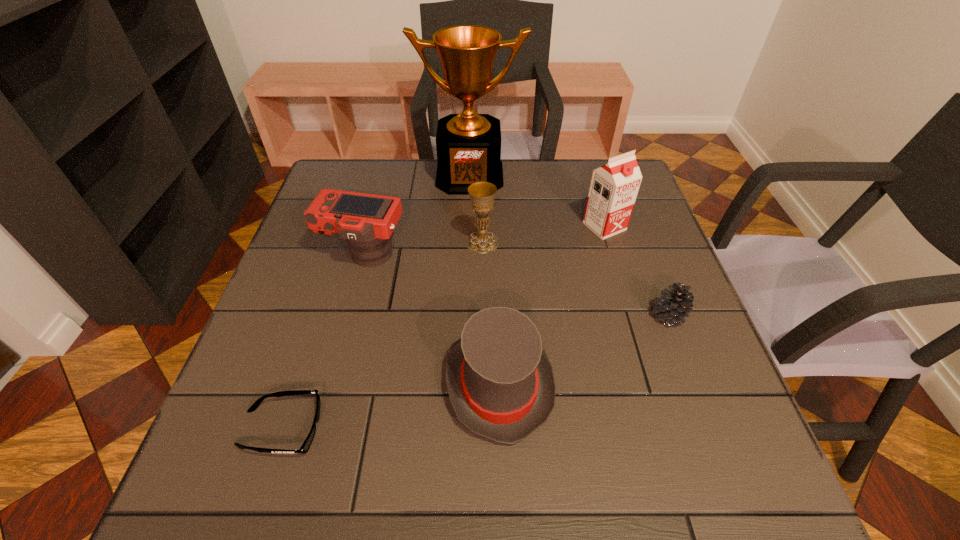
Where is `vacant area that lies between the sixth tallest object and the camera`? This screenshot has width=960, height=540. vacant area that lies between the sixth tallest object and the camera is located at coordinates (516, 286).

Locate an element on the screen. empty space that is in between the camera and the chalice is located at coordinates (422, 248).

Where is `empty space that is in between the dress hat and the shortest object`? The height and width of the screenshot is (540, 960). empty space that is in between the dress hat and the shortest object is located at coordinates (390, 407).

What are the coordinates of `unoccupied area between the dress hat and the camera` in the screenshot? It's located at (431, 320).

In order to click on free area in between the shortest object and the dress hat in this screenshot , I will do `click(390, 407)`.

You are a GUI agent. You are given a task and a screenshot of the screen. Output one action in this format:
    pyautogui.click(x=<x>, y=<y>)
    Task: Click on the object that can be found as the third closest to the soya milk
    
    Given the screenshot: What is the action you would take?
    (x=482, y=194)

Identify which object is located as the second nearest to the sixth shortest object. Please provide its 2D coordinates. Your answer should be formatted as a tuple, i.e. [(x, y)], where the tuple contains the x and y coordinates of a point satisfying the conditions above.

[(674, 305)]

This screenshot has height=540, width=960. Identify the location of free region that satisfies the following two spatial constraints: 1. on the front of the sixth tallest object with the label; 2. on the right side of the farthest object. (466, 316).

Find the location of a particular element. Image resolution: width=960 pixels, height=540 pixels. vacant space that satisfies the following two spatial constraints: 1. on the front side of the chalice; 2. on the left side of the sixth tallest object is located at coordinates (483, 316).

Where is `vacant space that satisfies the following two spatial constraints: 1. on the back side of the camera; 2. on the right side of the soya milk`? vacant space that satisfies the following two spatial constraints: 1. on the back side of the camera; 2. on the right side of the soya milk is located at coordinates (371, 226).